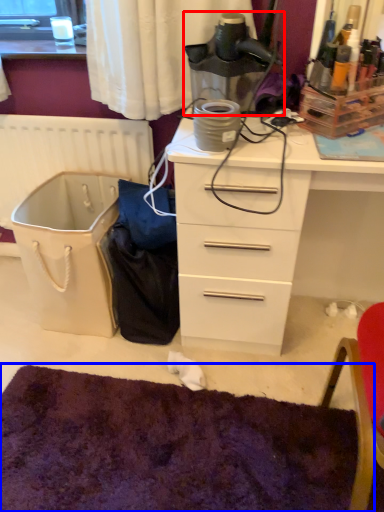
Question: Which object is further to the camera taking this photo, appliance (highlighted by a red box) or mat (highlighted by a blue box)?

Choices:
 (A) appliance
 (B) mat

Answer: (A)